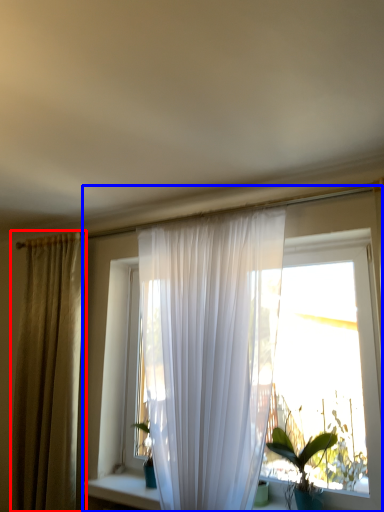
Question: Among these objects, which one is nearest to the camera, curtain (highlighted by a red box) or window (highlighted by a blue box)?

Choices:
 (A) curtain
 (B) window

Answer: (B)